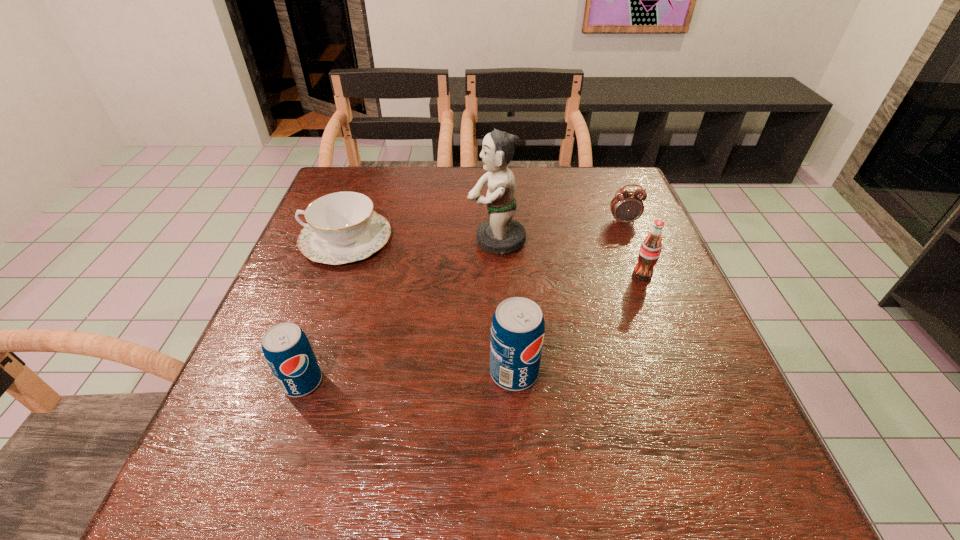
Image resolution: width=960 pixels, height=540 pixels. What are the coordinates of `the leftmost soda` in the screenshot? It's located at (286, 348).

Where is `the second soda from left to right`? This screenshot has height=540, width=960. the second soda from left to right is located at coordinates (517, 331).

Identify the location of chinaware. (342, 227).

Locate an element on the screen. alarm clock is located at coordinates (627, 206).

Where is `figurine`? This screenshot has width=960, height=540. figurine is located at coordinates (500, 235).

Image resolution: width=960 pixels, height=540 pixels. Identify the location of the rightmost soda. (649, 253).

This screenshot has height=540, width=960. Identify the location of free location located on the right of the leftmost soda. (426, 382).

Image resolution: width=960 pixels, height=540 pixels. What are the coordinates of `vacant space located 0.240m on the back of the second soda from right to left` in the screenshot? It's located at (507, 270).

Where is `vacant space located on the face of the alarm clock`? This screenshot has width=960, height=540. vacant space located on the face of the alarm clock is located at coordinates (661, 317).

Locate an element on the screen. This screenshot has height=540, width=960. free space located 0.180m on the front-facing side of the tallest object is located at coordinates (396, 240).